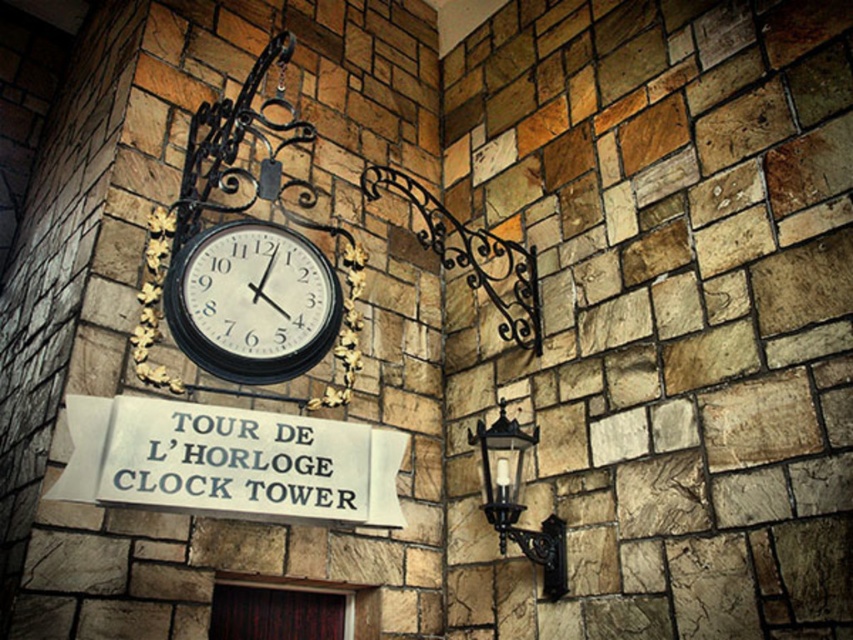
Consider the image. You are a painter who needs to decide which object to paint first. Since you want to start with the taller one, which object should you choose between the black glossy clock at center and the black wrought iron lamp at lower right?

The black wrought iron lamp at lower right is taller than the black glossy clock at center, so you should paint the black wrought iron lamp at lower right first.

You are standing in front of the stone wall and want to read the text on the white metallic sign at center. Is the black wrought iron lamp at lower right blocking your view of the sign?

The white metallic sign at center is in front of the black wrought iron lamp at lower right, so the lamp is not blocking your view of the sign.